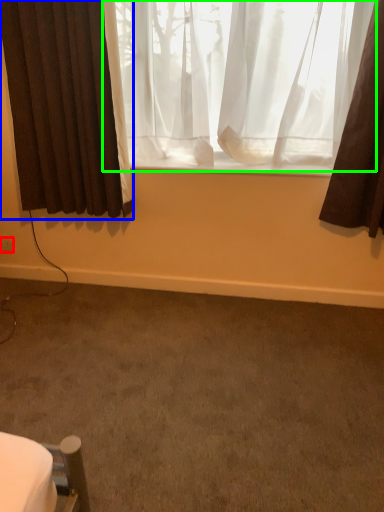
Question: Considering the real-world distances, which object is closest to electric outlet (highlighted by a red box)? curtain (highlighted by a blue box) or curtain (highlighted by a green box).

Choices:
 (A) curtain
 (B) curtain

Answer: (A)